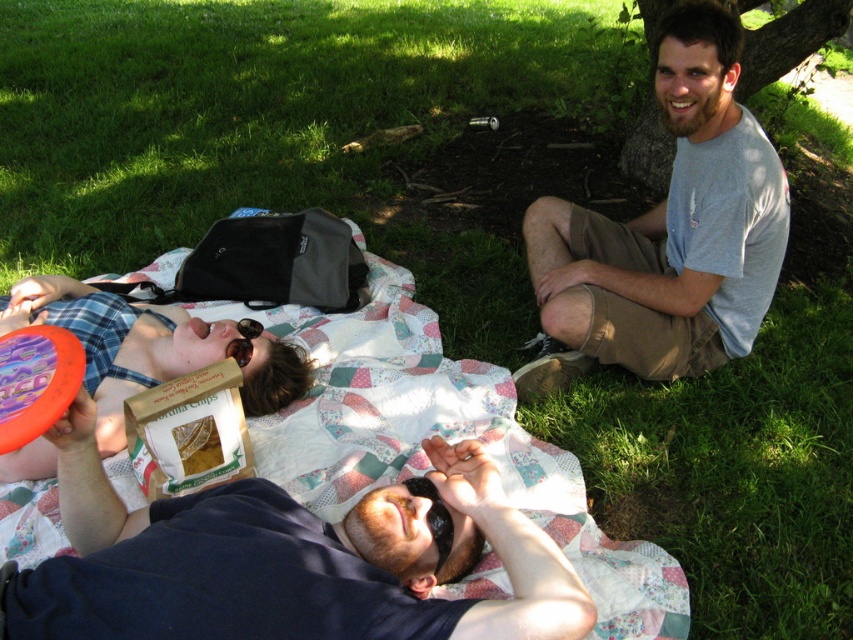
Question: Which point appears farthest from the camera in this image?

Choices:
 (A) (343, 528)
 (B) (65, 394)

Answer: (A)

Question: Is gray cotton shirt at upper right further to camera compared to matte brown bag at upper left?

Choices:
 (A) yes
 (B) no

Answer: (A)

Question: Does green bark tree at upper right come in front of translucent plastic frisbee at lower left?

Choices:
 (A) no
 (B) yes

Answer: (A)

Question: Among these points, which one is nearest to the camera?

Choices:
 (A) tap(136, 337)
 (B) tap(231, 566)

Answer: (B)

Question: Can you confirm if matte brown bag at upper left is bigger than green bark tree at upper right?

Choices:
 (A) yes
 (B) no

Answer: (A)

Question: Which point is farther to the camera?

Choices:
 (A) (65, 342)
 (B) (302, 388)

Answer: (B)